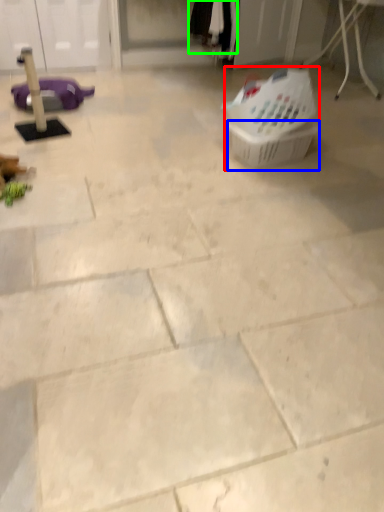
Question: Considering the real-world distances, which object is farthest from basket (highlighted by a red box)? basket (highlighted by a blue box) or clothing (highlighted by a green box)?

Choices:
 (A) basket
 (B) clothing

Answer: (B)